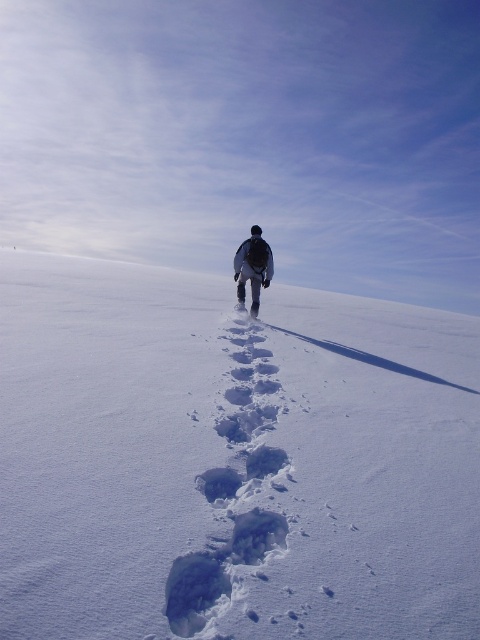
Is the position of white powdery snow at center less distant than that of dark gray fabric jacket at center?

Yes, it is in front of dark gray fabric jacket at center.

Measure the distance between point (207, 413) and camera.

Point (207, 413) and camera are 4.22 meters apart.

Image resolution: width=480 pixels, height=640 pixels. Find the location of `white powdery snow at center`. white powdery snow at center is located at coordinates (231, 460).

Find the location of a particular element. This screenshot has height=640, width=480. white powdery snow at center is located at coordinates pos(231,460).